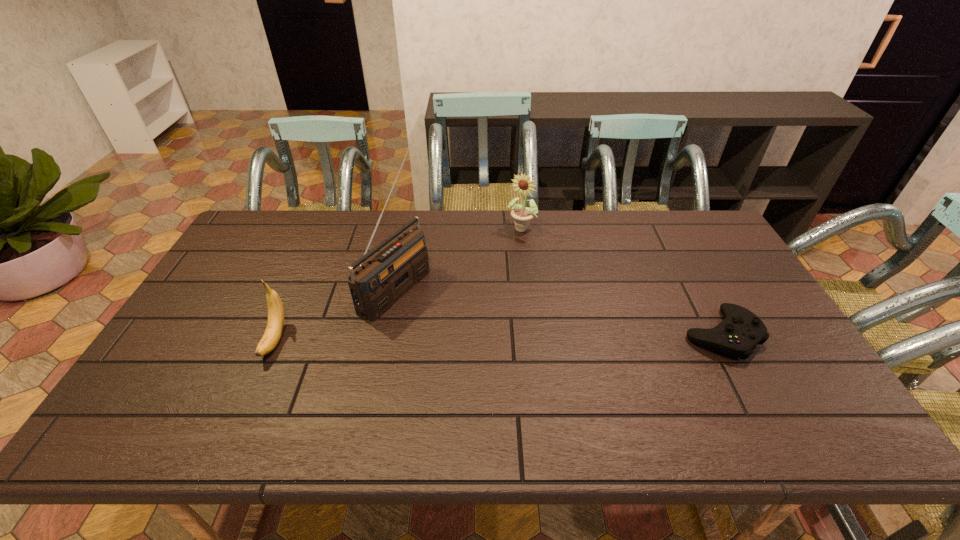
This screenshot has height=540, width=960. I want to click on the leftmost object, so click(x=270, y=339).

Find the location of a particular element. This screenshot has width=960, height=540. banana is located at coordinates (270, 339).

Locate an element on the screen. control is located at coordinates (741, 330).

Where is `the shortest object`? the shortest object is located at coordinates (741, 330).

At what (x,y) coordinates should I click in order to perform the action: click on the tallest object. Please return your answer as a coordinate pair (x, y). Looking at the image, I should click on (375, 286).

Locate an element on the screen. This screenshot has height=540, width=960. radio receiver is located at coordinates (375, 286).

Locate an element on the screen. The width and height of the screenshot is (960, 540). sunflower is located at coordinates (522, 215).

Identify the location of the farthest object. (522, 215).

You are a GUI agent. You are given a task and a screenshot of the screen. Output one action in this format:
    pyautogui.click(x=<x>, y=<y>)
    Task: Click on the free space located 0.080m at the start of the peel on the second shortest object
    This screenshot has height=540, width=960.
    Given the screenshot: What is the action you would take?
    pyautogui.click(x=252, y=393)

Where is `vacant region located on the front of the shortest object`? This screenshot has height=540, width=960. vacant region located on the front of the shortest object is located at coordinates (755, 399).